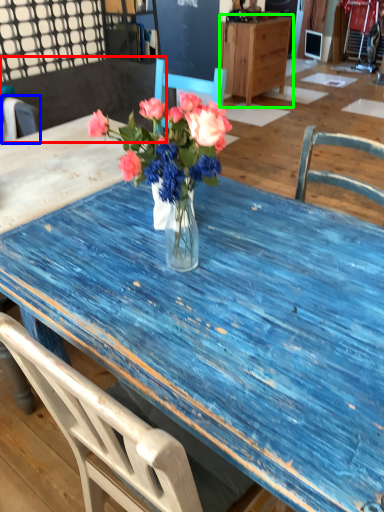
Question: Which object is positioned closest to chair (highlighted by a red box)? Select from chair (highlighted by a blue box) and cabinetry (highlighted by a green box).

Choices:
 (A) chair
 (B) cabinetry

Answer: (A)